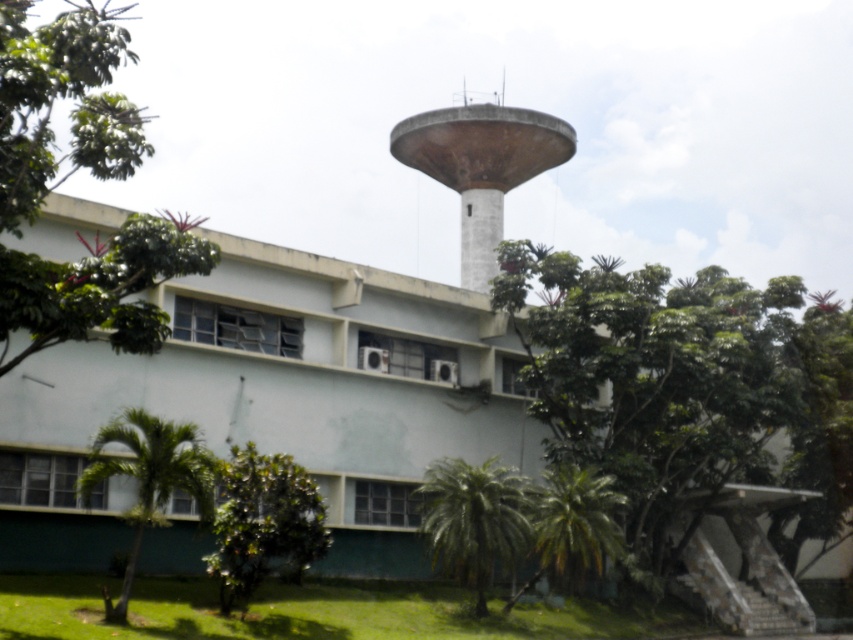
You are standing in front of the building and want to plant a new tree in the lawn. The green leafy palm at lower center is represented by point (x=474, y=518). Where should you plant the new tree to ensure it is not too close to the existing palm? Please provide coordinates in the format x,y where x and y are between 0 and 1.

The green leafy palm at lower center is located at point (x=474, y=518). To ensure the new tree is not too close, plant it at coordinates 0.6, 0.6 which is sufficiently spaced away from the existing palm.